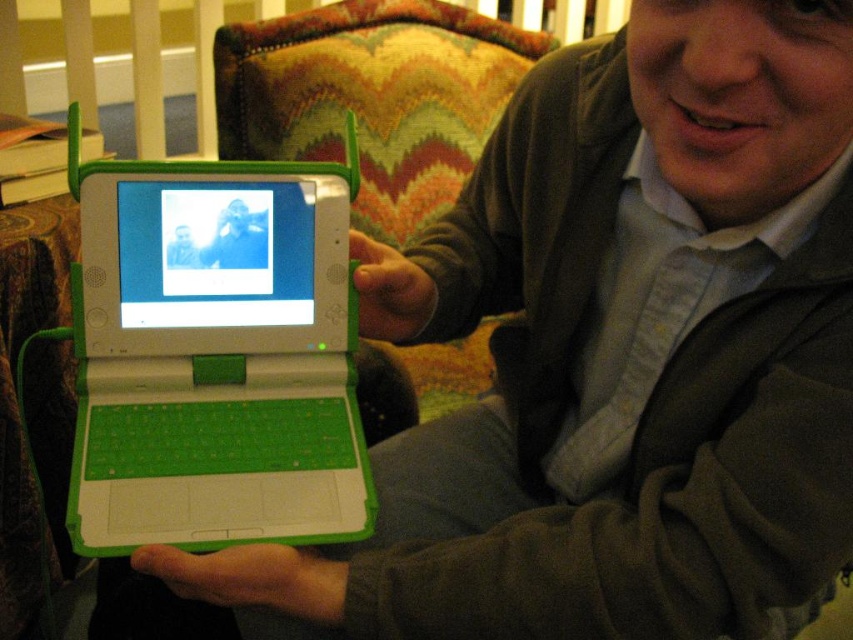
Does green plastic laptop at center have a greater height compared to matte green laptop at center?

Yes.

Identify the location of green plastic laptop at center. Image resolution: width=853 pixels, height=640 pixels. (213, 358).

In order to click on green plastic laptop at center in this screenshot , I will do `click(213, 358)`.